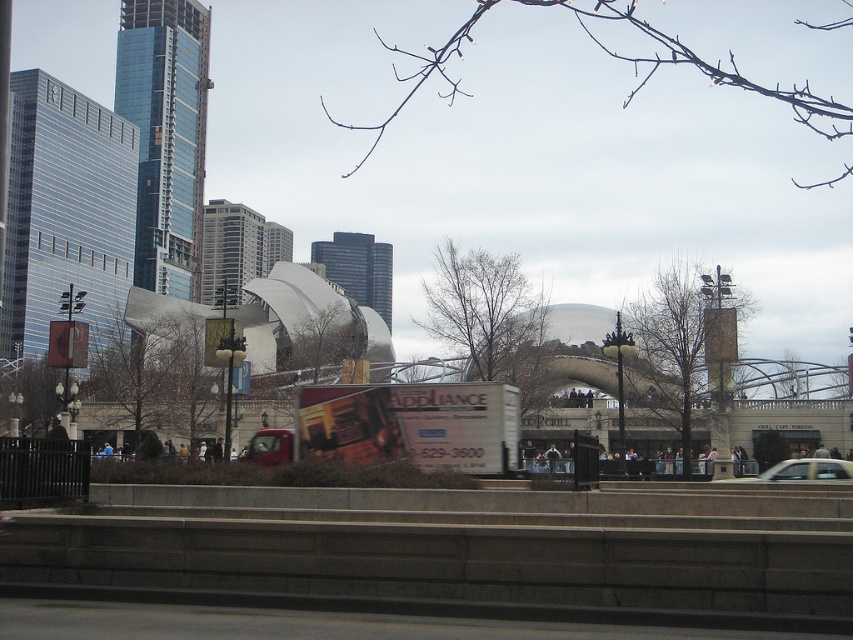
Between white matte billboard at center and metallic red truck at center, which one has less height?

white matte billboard at center is shorter.

Which is in front, point (440, 449) or point (263, 452)?

Point (440, 449)

The height and width of the screenshot is (640, 853). I want to click on white matte billboard at center, so click(x=413, y=424).

Is point (804, 458) closer to camera compared to point (260, 440)?

Yes, it is in front of point (260, 440).

The width and height of the screenshot is (853, 640). Describe the element at coordinates (802, 472) in the screenshot. I see `silver metallic car at center` at that location.

Image resolution: width=853 pixels, height=640 pixels. I want to click on silver metallic car at center, so click(x=802, y=472).

Between white matte billboard at center and silver metallic car at center, which one has less height?

Standing shorter between the two is silver metallic car at center.

Who is more distant from viewer, (403,428) or (770,474)?

Point (403,428)

I want to click on white matte billboard at center, so click(x=413, y=424).